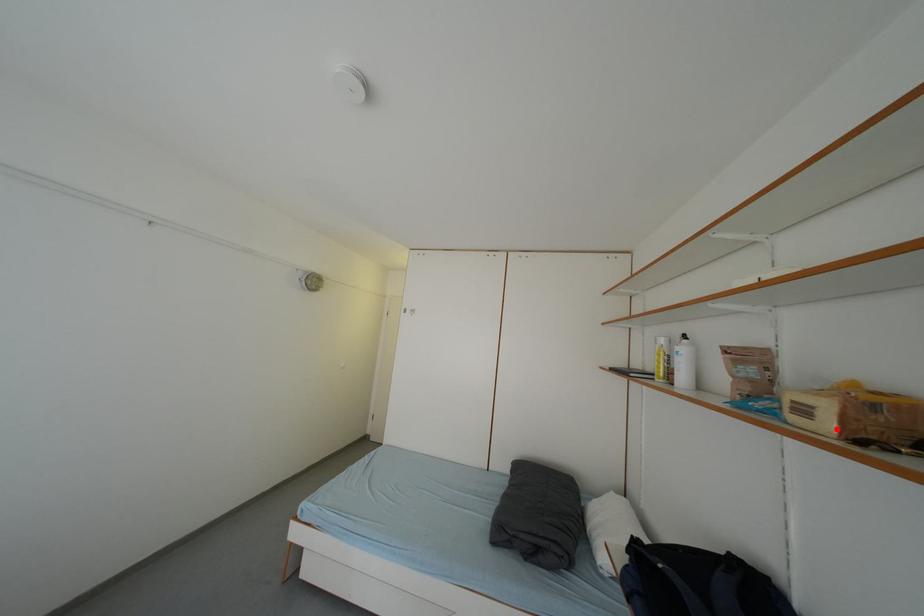
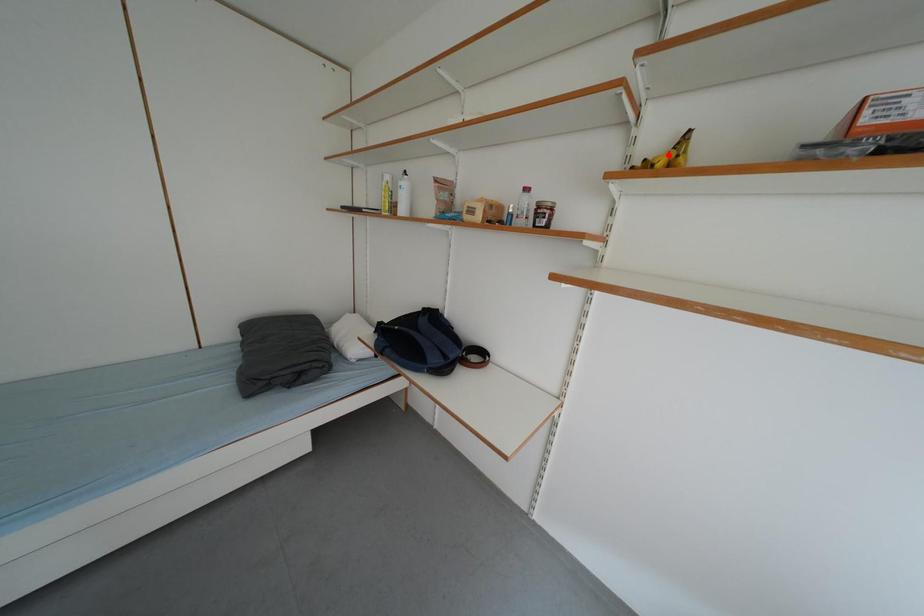
I am providing you with two images of the same scene from different viewpoints. A red point is marked on the first image and another point is marked on the second image. Is the marked point in image1 the same physical position as the marked point in image2?

No